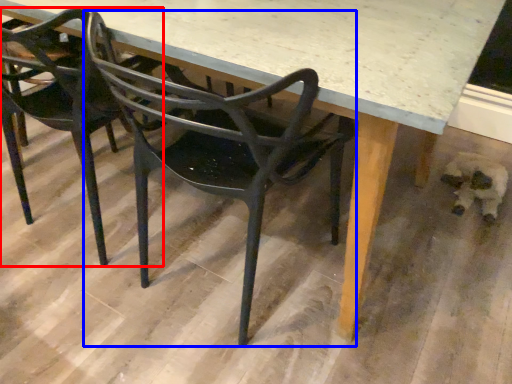
Question: Which point is further to the camera, chair (highlighted by a red box) or chair (highlighted by a blue box)?

Choices:
 (A) chair
 (B) chair

Answer: (A)